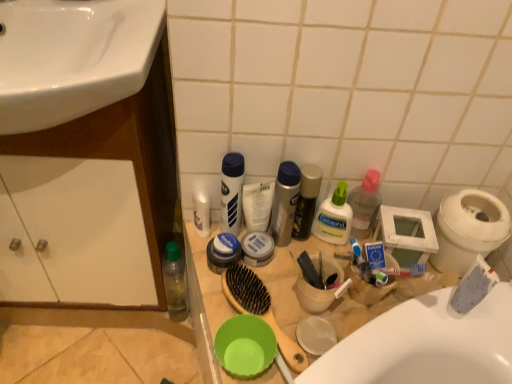
Identify the location of vacant space behind brown wooden brush at center. 282,273.